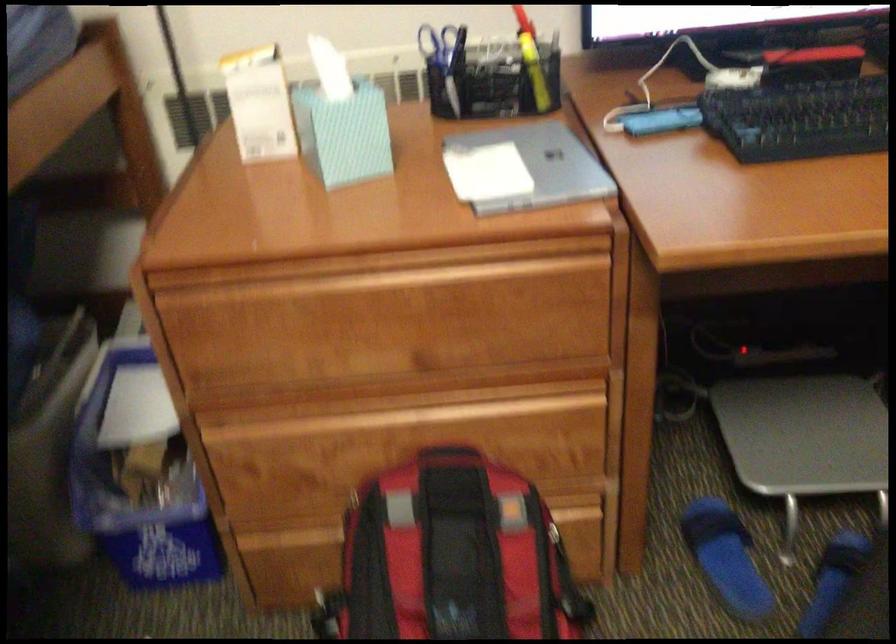
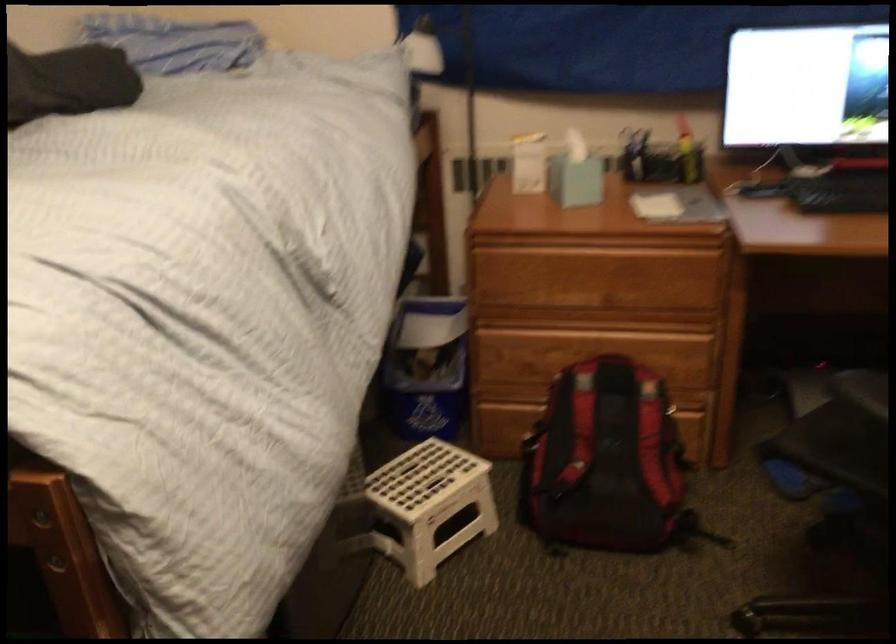
In the second image, find the point that corresponds to point 149,469 in the first image.

(426, 368)